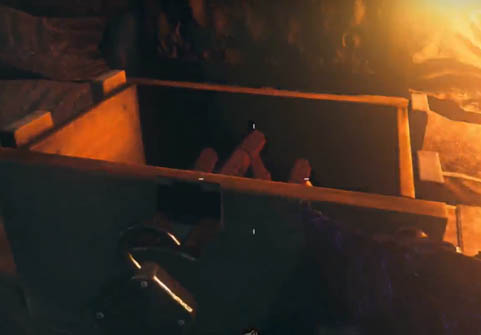
The height and width of the screenshot is (335, 481). Identify the location of width sides of wooden box. (405, 166), (102, 118).